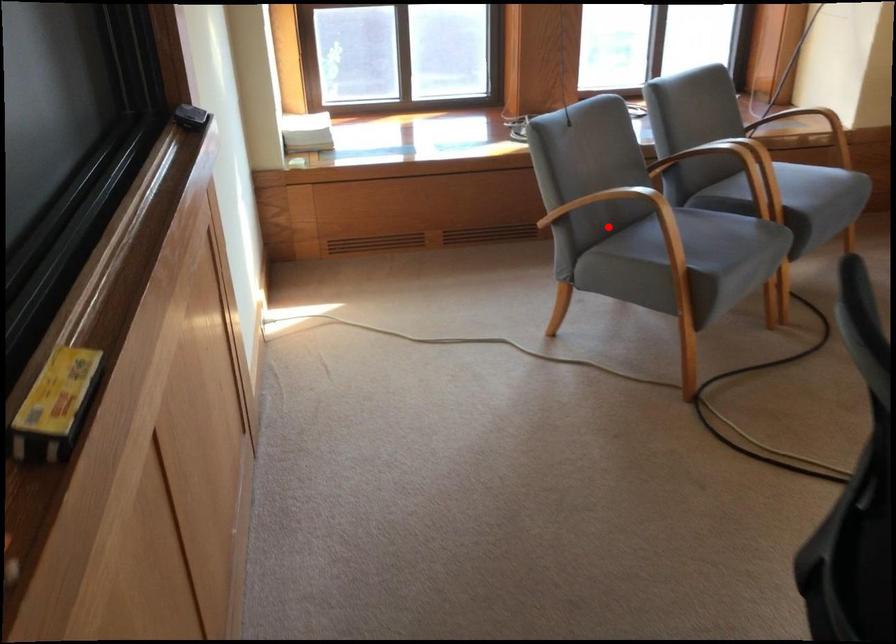
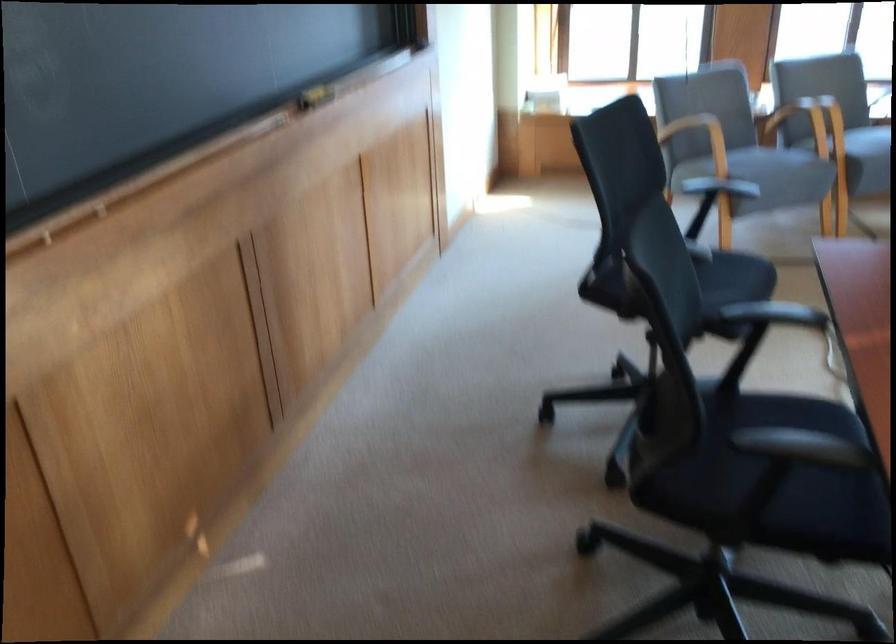
Question: I am providing you with two images of the same scene from different viewpoints. In image1, a red point is highlighted. Considering the same 3D point in image2, which of the following is correct?

Choices:
 (A) It is closer
 (B) It is farther

Answer: (B)